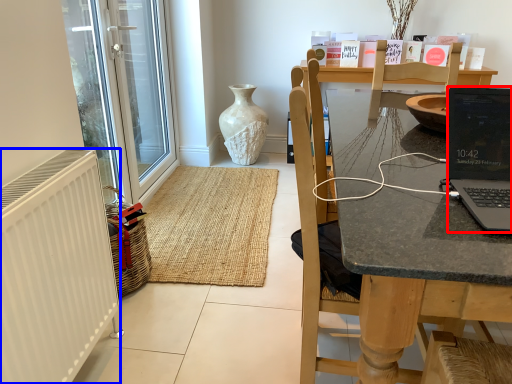
Question: Which object is closer to the camera taking this photo, laptop (highlighted by a red box) or radiator (highlighted by a blue box)?

Choices:
 (A) laptop
 (B) radiator

Answer: (A)